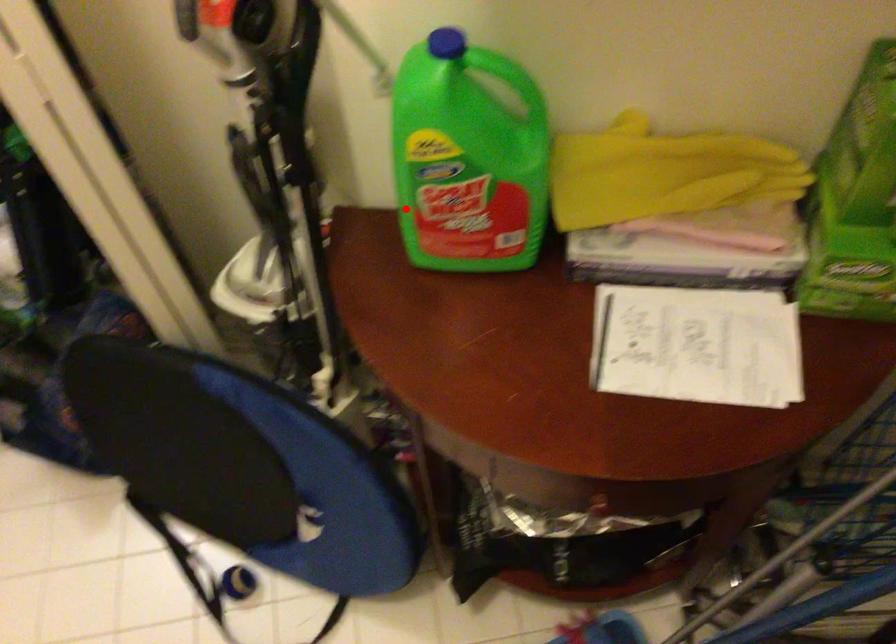
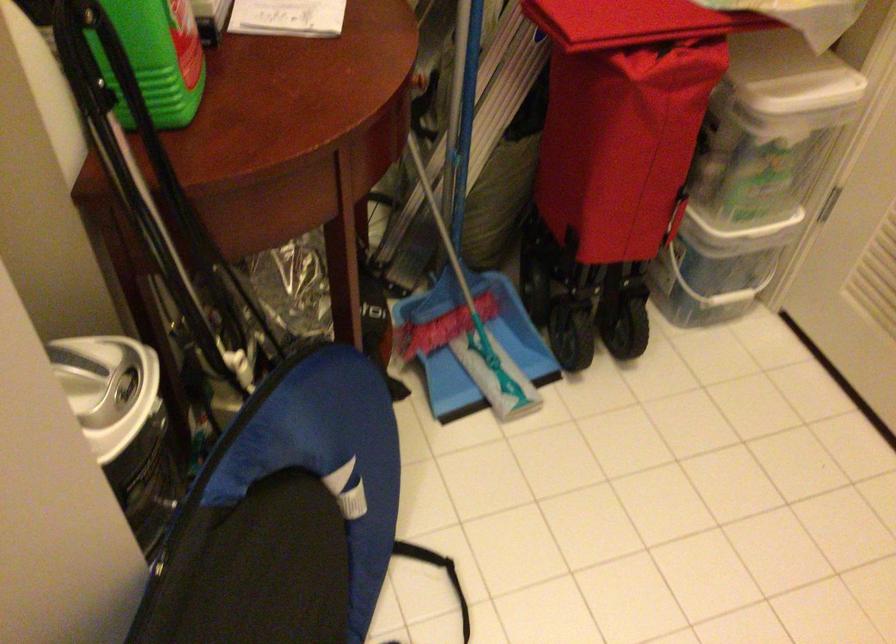
In the second image, find the point that corresponds to the highlighted location in the first image.

(156, 59)